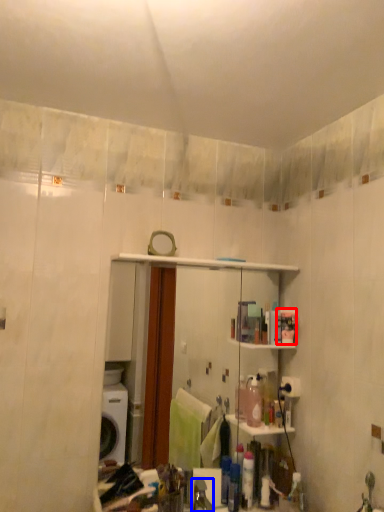
Question: Which point is closer to the camera, toiletry (highlighted by a red box) or faucet (highlighted by a blue box)?

Choices:
 (A) toiletry
 (B) faucet

Answer: (B)